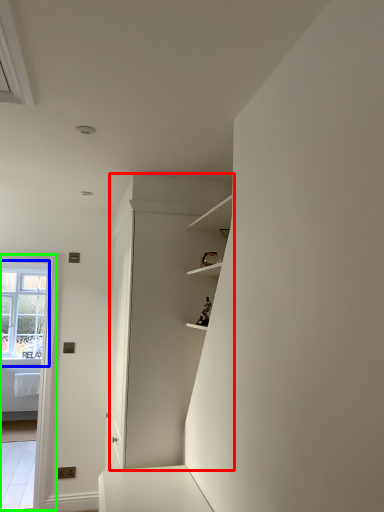
Question: Which object is positioned farthest from dresser (highlighted by a red box)? Select from window (highlighted by a blue box) and glass door (highlighted by a green box).

Choices:
 (A) window
 (B) glass door

Answer: (A)